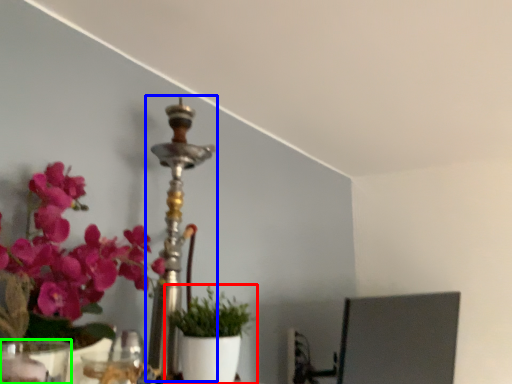
Question: Which is nearer to the houseplant (highlighted by a red box)? candle holder (highlighted by a blue box) or vase (highlighted by a green box).

Choices:
 (A) candle holder
 (B) vase

Answer: (A)